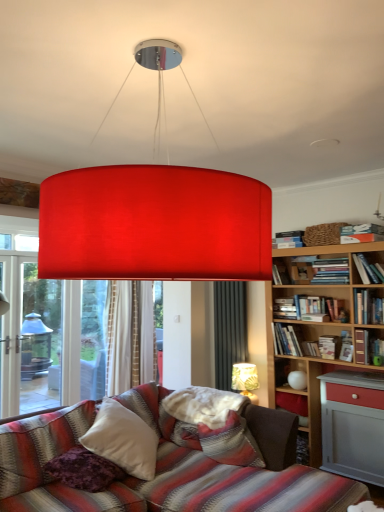
Question: Is hardcover book at right, the seventh book in the top-to-bottom sequence, further to the viewer compared to hardcover book at upper right, which is counted as the sixth book, starting from the top?

Choices:
 (A) no
 (B) yes

Answer: (A)

Question: Does hardcover book at right, the third book positioned from the bottom, have a greater width compared to hardcover book at upper right, which is counted as the sixth book, starting from the top?

Choices:
 (A) yes
 (B) no

Answer: (A)

Question: Does hardcover book at right, the seventh book in the top-to-bottom sequence, lie in front of hardcover book at upper right, which is counted as the sixth book, starting from the top?

Choices:
 (A) yes
 (B) no

Answer: (A)

Question: Considering the relative sizes of hardcover book at right, the seventh book in the top-to-bottom sequence, and hardcover book at upper right, positioned as the fourth book in bottom-to-top order, in the image provided, is hardcover book at right, the seventh book in the top-to-bottom sequence, taller than hardcover book at upper right, positioned as the fourth book in bottom-to-top order,?

Choices:
 (A) no
 (B) yes

Answer: (B)

Question: Is hardcover book at right, the third book positioned from the bottom, looking in the opposite direction of hardcover book at upper right, which is counted as the sixth book, starting from the top?

Choices:
 (A) yes
 (B) no

Answer: (B)

Question: Are hardcover book at right, the third book positioned from the bottom, and hardcover book at upper right, which is counted as the sixth book, starting from the top, located far from each other?

Choices:
 (A) no
 (B) yes

Answer: (A)

Question: Is the depth of hardcover books at upper right, positioned as the third book in top-to-bottom order, less than that of hardcover book at upper right, the 8th book ordered from the bottom?

Choices:
 (A) yes
 (B) no

Answer: (B)

Question: Is hardcover books at upper right, positioned as the third book in top-to-bottom order, aimed at hardcover book at upper right, placed as the second book when sorted from top to bottom?

Choices:
 (A) yes
 (B) no

Answer: (B)

Question: Is hardcover books at upper right, positioned as the third book in top-to-bottom order, taller than hardcover book at upper right, placed as the second book when sorted from top to bottom?

Choices:
 (A) yes
 (B) no

Answer: (B)

Question: Is hardcover books at upper right, positioned as the third book in top-to-bottom order, directly adjacent to hardcover book at upper right, placed as the second book when sorted from top to bottom?

Choices:
 (A) no
 (B) yes

Answer: (A)

Question: From the image's perspective, is hardcover books at upper right, positioned as the third book in top-to-bottom order, located beneath hardcover book at upper right, the 8th book ordered from the bottom?

Choices:
 (A) no
 (B) yes

Answer: (B)

Question: Considering the relative positions of hardcover books at upper right, positioned as the third book in top-to-bottom order, and hardcover book at upper right, the 8th book ordered from the bottom, in the image provided, is hardcover books at upper right, positioned as the third book in top-to-bottom order, to the left of hardcover book at upper right, the 8th book ordered from the bottom, from the viewer's perspective?

Choices:
 (A) yes
 (B) no

Answer: (A)

Question: Is hardcover book at upper right, placed as the second book when sorted from top to bottom, positioned in front of white soft pillow at center, the second pillow in the left-to-right sequence?

Choices:
 (A) no
 (B) yes

Answer: (A)